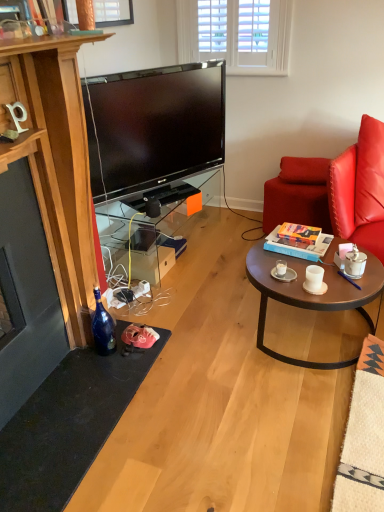
Locate an element on the screen. The height and width of the screenshot is (512, 384). transparent glass tv stand at center is located at coordinates (158, 223).

Where is `white ceramic coffee cup at right, the third coffee cup positioned from the left`? This screenshot has height=512, width=384. white ceramic coffee cup at right, the third coffee cup positioned from the left is located at coordinates (355, 263).

The image size is (384, 512). Describe the element at coordinates (304, 170) in the screenshot. I see `leather cushion at right` at that location.

What do you see at coordinates (281, 267) in the screenshot? This screenshot has width=384, height=512. I see `white ceramic cup at center, which is the first coffee cup in left-to-right order` at bounding box center [281, 267].

Locate an element on the screen. This screenshot has width=384, height=512. blue glass bottle at lower left is located at coordinates (103, 327).

The width and height of the screenshot is (384, 512). What are the coordinates of `leather swivel chair at right` in the screenshot? It's located at (298, 194).

The height and width of the screenshot is (512, 384). What do you see at coordinates (313, 295) in the screenshot?
I see `brown wooden coffee table at center` at bounding box center [313, 295].

Identify the location of transparent glass tv stand at center. This screenshot has height=512, width=384. (158, 223).

From a real-world perspective, which is physically above, hardcover book at center or transparent glass tv stand at center?

hardcover book at center, from a real-world perspective.

Between point (268, 247) and point (193, 213), which one is positioned behind?

The point (193, 213) is farther.

From the picture: Does hardcover book at center have a lesser width compared to transparent glass tv stand at center?

Correct, the width of hardcover book at center is less than that of transparent glass tv stand at center.

Does hardcover book at center have a greater height compared to transparent glass tv stand at center?

Incorrect, the height of hardcover book at center is not larger of that of transparent glass tv stand at center.

From the picture: Between purple plastic pen at coffee table and white ceramic coffee cup at right, the third coffee cup positioned from the left, which one has smaller size?

Smaller between the two is purple plastic pen at coffee table.

Is purple plastic pen at coffee table touching white ceramic coffee cup at right, the third coffee cup positioned from the left?

Yes, purple plastic pen at coffee table is in contact with white ceramic coffee cup at right, the third coffee cup positioned from the left.

Could you measure the distance between purple plastic pen at coffee table and white ceramic coffee cup at right, which is the first coffee cup in right-to-left order?

purple plastic pen at coffee table and white ceramic coffee cup at right, which is the first coffee cup in right-to-left order, are 5.83 centimeters apart from each other.

Between point (352, 283) and point (354, 277), which one is positioned behind?

The point (354, 277) is more distant.

How much distance is there between white matte coffee cup at center right, placed as the 2th coffee cup when sorted from right to left, and hardcover book at center?

A distance of 7.29 inches exists between white matte coffee cup at center right, placed as the 2th coffee cup when sorted from right to left, and hardcover book at center.

Is hardcover book at center at the back of white matte coffee cup at center right, placed as the 2th coffee cup when sorted from right to left?

Yes.

Which is correct: white matte coffee cup at center right, which ranks as the 2th coffee cup in left-to-right order, is inside hardcover book at center, or outside of it?

The correct answer is: outside.

Can you confirm if white matte coffee cup at center right, which ranks as the 2th coffee cup in left-to-right order, is bigger than hardcover book at center?

Actually, white matte coffee cup at center right, which ranks as the 2th coffee cup in left-to-right order, might be smaller than hardcover book at center.

Considering the relative sizes of white ceramic coffee cup at right, the third coffee cup positioned from the left, and white matte coffee cup at center right, which ranks as the 2th coffee cup in left-to-right order, in the image provided, is white ceramic coffee cup at right, the third coffee cup positioned from the left, taller than white matte coffee cup at center right, which ranks as the 2th coffee cup in left-to-right order,?

Yes.

Are white ceramic coffee cup at right, the third coffee cup positioned from the left, and white matte coffee cup at center right, placed as the 2th coffee cup when sorted from right to left, far apart?

That's not correct — white ceramic coffee cup at right, the third coffee cup positioned from the left, is a little close to white matte coffee cup at center right, placed as the 2th coffee cup when sorted from right to left.

From a real-world perspective, is white ceramic coffee cup at right, which is the first coffee cup in right-to-left order, on white matte coffee cup at center right, placed as the 2th coffee cup when sorted from right to left?

Yes, from a real-world perspective, white ceramic coffee cup at right, which is the first coffee cup in right-to-left order, is over white matte coffee cup at center right, placed as the 2th coffee cup when sorted from right to left

Is white matte coffee cup at center right, placed as the 2th coffee cup when sorted from right to left, surrounded by white ceramic coffee cup at right, which is the first coffee cup in right-to-left order?

That's incorrect, white matte coffee cup at center right, placed as the 2th coffee cup when sorted from right to left, is not inside white ceramic coffee cup at right, which is the first coffee cup in right-to-left order.

Is point (349, 280) farther from camera compared to point (319, 285)?

That is True.

Looking at this image, is purple plastic pen at coffee table with white matte coffee cup at center right, which ranks as the 2th coffee cup in left-to-right order?

There is a gap between purple plastic pen at coffee table and white matte coffee cup at center right, which ranks as the 2th coffee cup in left-to-right order.

Is purple plastic pen at coffee table oriented away from white matte coffee cup at center right, which ranks as the 2th coffee cup in left-to-right order?

No, purple plastic pen at coffee table is not facing the opposite direction of white matte coffee cup at center right, which ranks as the 2th coffee cup in left-to-right order.

Between purple plastic pen at coffee table and white matte coffee cup at center right, which ranks as the 2th coffee cup in left-to-right order, which one has more height?

Standing taller between the two is white matte coffee cup at center right, which ranks as the 2th coffee cup in left-to-right order.

Looking at their sizes, would you say leather swivel chair at right is wider or thinner than white matte coffee cup at center right, placed as the 2th coffee cup when sorted from right to left?

In the image, leather swivel chair at right appears to be wider than white matte coffee cup at center right, placed as the 2th coffee cup when sorted from right to left.

How many degrees apart are the facing directions of leather swivel chair at right and white matte coffee cup at center right, which ranks as the 2th coffee cup in left-to-right order?

There is a 76.5-degree angle between the facing directions of leather swivel chair at right and white matte coffee cup at center right, which ranks as the 2th coffee cup in left-to-right order.

In terms of height, does leather swivel chair at right look taller or shorter compared to white matte coffee cup at center right, which ranks as the 2th coffee cup in left-to-right order?

Clearly, leather swivel chair at right is taller compared to white matte coffee cup at center right, which ranks as the 2th coffee cup in left-to-right order.

Is leather swivel chair at right facing towards white matte coffee cup at center right, which ranks as the 2th coffee cup in left-to-right order?

No, leather swivel chair at right does not turn towards white matte coffee cup at center right, which ranks as the 2th coffee cup in left-to-right order.

From the image's perspective, does leather swivel chair at right appear higher than brown wooden coffee table at center?

Correct, leather swivel chair at right appears higher than brown wooden coffee table at center in the image.

Would you say leather swivel chair at right is to the left or to the right of brown wooden coffee table at center in the picture?

From the image, it's evident that leather swivel chair at right is to the right of brown wooden coffee table at center.

Can you tell me how much leather swivel chair at right and brown wooden coffee table at center differ in facing direction?

The angle between the facing direction of leather swivel chair at right and the facing direction of brown wooden coffee table at center is 27.5 degrees.

Does point (291, 210) lie in front of point (383, 288)?

That is False.

What are the coordinates of `box in front of the transparent glass tv stand at center` in the screenshot? It's located at (297, 246).

This screenshot has width=384, height=512. What are the coordinates of `pen below the white ceramic coffee cup at right, which is the first coffee cup in right-to-left order (from a real-world perspective)` in the screenshot? It's located at (348, 279).

Estimate the real-world distances between objects in this image. Which object is further from white matte coffee cup at center right, which ranks as the 2th coffee cup in left-to-right order, brown wooden coffee table at center or white ceramic cup at center, which is the first coffee cup in left-to-right order?

Among the two, brown wooden coffee table at center is located further to white matte coffee cup at center right, which ranks as the 2th coffee cup in left-to-right order.

Based on their spatial positions, is white ceramic cup at center, which is the first coffee cup in left-to-right order, or brown wooden coffee table at center closer to leather swivel chair at right?

brown wooden coffee table at center is closer to leather swivel chair at right.

Consider the image. Based on their spatial positions, is white ceramic cup at center, which is counted as the third coffee cup, starting from the right, or white ceramic coffee cup at right, the third coffee cup positioned from the left, closer to leather swivel chair at right?

The object closer to leather swivel chair at right is white ceramic coffee cup at right, the third coffee cup positioned from the left.

From the image, which object appears to be farther from blue glass bottle at lower left, white ceramic cup at center, which is counted as the third coffee cup, starting from the right, or transparent glass tv stand at center?

white ceramic cup at center, which is counted as the third coffee cup, starting from the right, is positioned further to the anchor blue glass bottle at lower left.

Which object lies further to the anchor point white ceramic cup at center, which is counted as the third coffee cup, starting from the right, blue glass bottle at lower left or white matte coffee cup at center right, placed as the 2th coffee cup when sorted from right to left?

blue glass bottle at lower left lies further to white ceramic cup at center, which is counted as the third coffee cup, starting from the right, than the other object.

Considering their positions, is leather swivel chair at right positioned closer to transparent glass tv stand at center than blue glass bottle at lower left?

leather swivel chair at right is positioned closer to the anchor transparent glass tv stand at center.

Which object lies further to the anchor point white ceramic cup at center, which is counted as the third coffee cup, starting from the right, purple plastic pen at coffee table or leather cushion at right?

leather cushion at right is positioned further to the anchor white ceramic cup at center, which is counted as the third coffee cup, starting from the right.

Based on their spatial positions, is white ceramic coffee cup at right, which is the first coffee cup in right-to-left order, or leather swivel chair at right closer to purple plastic pen at coffee table?

white ceramic coffee cup at right, which is the first coffee cup in right-to-left order, is positioned closer to the anchor purple plastic pen at coffee table.

Identify the location of box between white ceramic cup at center, which is counted as the third coffee cup, starting from the right, and leather cushion at right, along the z-axis. This screenshot has width=384, height=512. (297, 246).

Image resolution: width=384 pixels, height=512 pixels. What are the coordinates of `coffee table between blue glass bottle at lower left and white ceramic coffee cup at right, the third coffee cup positioned from the left, in the horizontal direction` in the screenshot? It's located at (313, 295).

What are the coordinates of `pen located between white matte coffee cup at center right, which ranks as the 2th coffee cup in left-to-right order, and leather cushion at right in the depth direction` in the screenshot? It's located at (348, 279).

What are the coordinates of `swivel chair between brown wooden coffee table at center and leather cushion at right from front to back` in the screenshot? It's located at (298, 194).